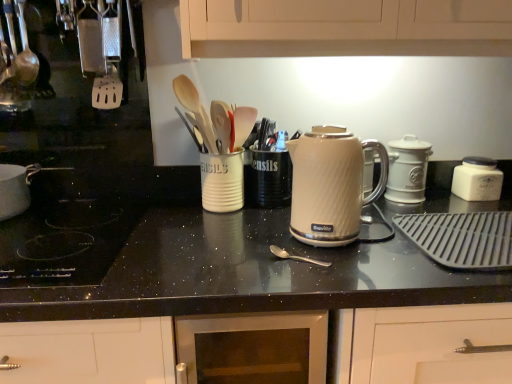
Where is `space that is in front of cream matte electric kettle at center, which is counted as the first kitchen appliance, starting from the left`? The image size is (512, 384). space that is in front of cream matte electric kettle at center, which is counted as the first kitchen appliance, starting from the left is located at coordinates (371, 266).